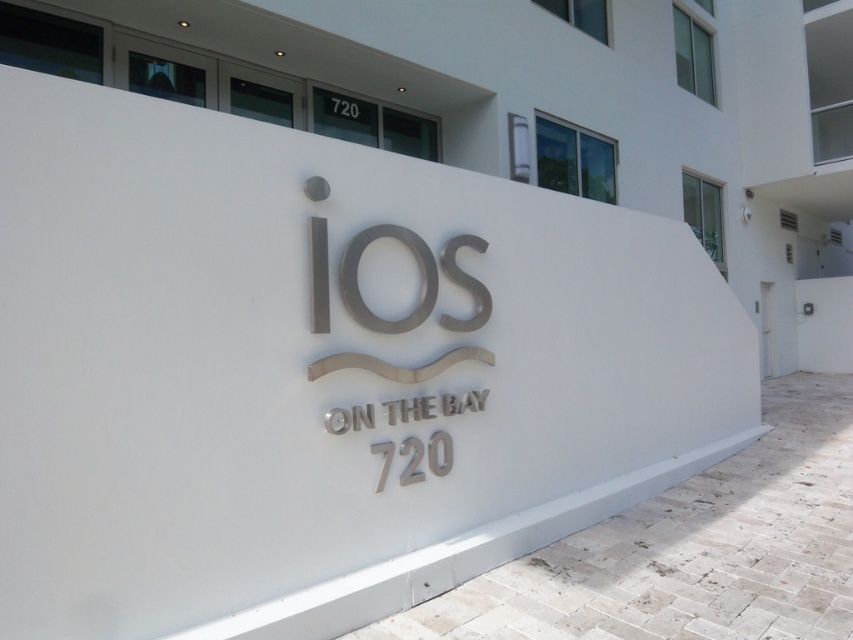
You are a delivery person trying to read the address on the building. You notice two elements on the wall. Which one is closer to you, the satin silver sign at center or the white metallic number at upper center?

The satin silver sign at center is closer to you because it is in front of the white metallic number at upper center.

You are an architect reviewing the building facade. You notice two numbers on the wall. The silver metallic number at center and the white metallic number at upper center. Which number takes up more space on the wall?

The white metallic number at upper center takes up more space on the wall than the silver metallic number at center because the silver metallic number at center occupies less space than white metallic number at upper center.